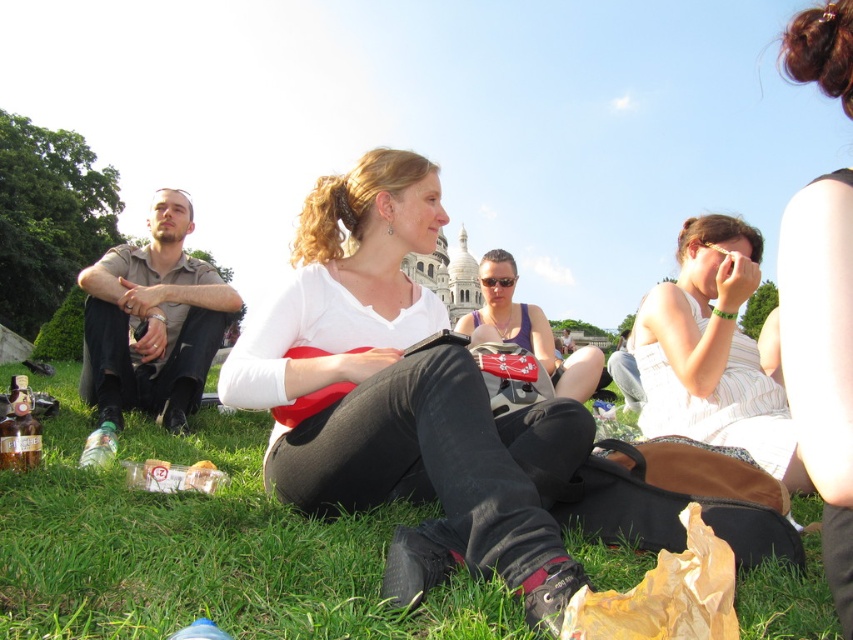
Question: Which object appears closest to the camera in this image?

Choices:
 (A) white matte shirt at center
 (B) matte purple tank top at center

Answer: (A)

Question: Among these objects, which one is nearest to the camera?

Choices:
 (A) green grass at lower center
 (B) matte purple tank top at center

Answer: (A)

Question: Can you confirm if white matte shirt at center is positioned to the left of matte purple tank top at center?

Choices:
 (A) yes
 (B) no

Answer: (A)

Question: Which point is farther to the camera?

Choices:
 (A) white striped dress at center
 (B) matte purple tank top at center
 (C) white matte shirt at center
 (D) smooth brown hair at upper right

Answer: (B)

Question: Does white matte shirt at center have a smaller size compared to smooth brown hair at upper right?

Choices:
 (A) no
 (B) yes

Answer: (A)

Question: Does white matte shirt at center have a smaller size compared to matte purple tank top at center?

Choices:
 (A) yes
 (B) no

Answer: (B)